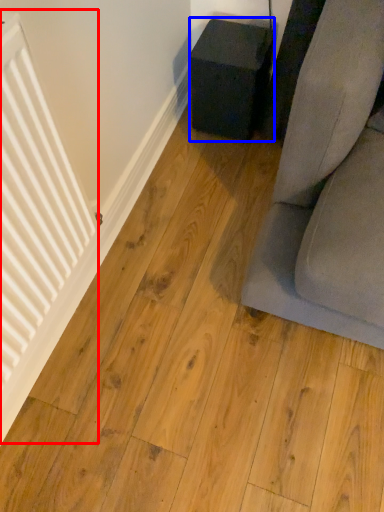
Question: Which object appears farthest to the camera in this image, radiator (highlighted by a red box) or furniture (highlighted by a blue box)?

Choices:
 (A) radiator
 (B) furniture

Answer: (B)